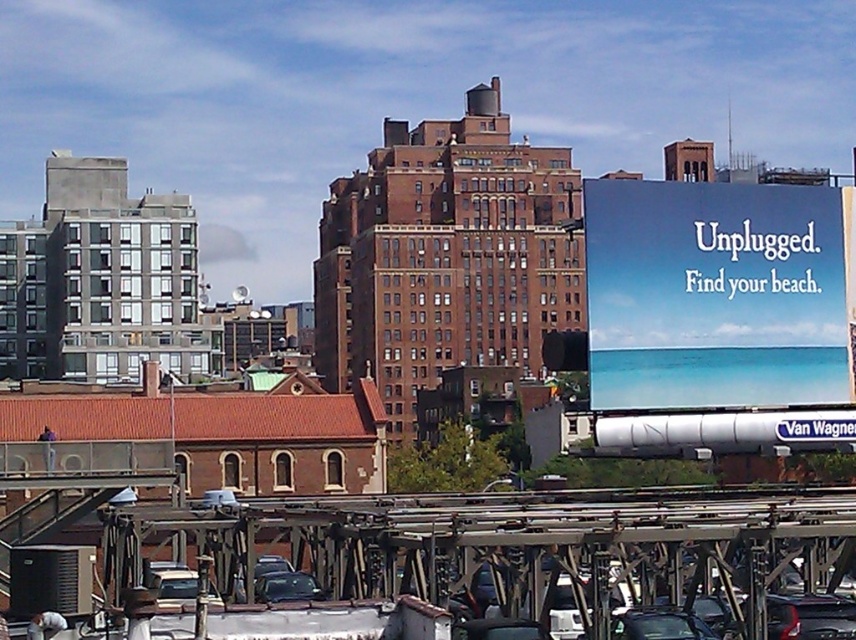
Between point (704, 218) and point (693, 616), which one is positioned in front?

Positioned in front is point (693, 616).

Based on the photo, does blue glossy billboard at upper right appear on the left side of shiny black sedan at center?

No, blue glossy billboard at upper right is not to the left of shiny black sedan at center.

Measure the distance between point [768,257] and camera.

They are 326.50 feet apart.

Where is `blue glossy billboard at upper right`? blue glossy billboard at upper right is located at coordinates (715, 296).

Is the position of metallic gray overpass at lower center less distant than that of shiny black sedan at center?

Yes, it is in front of shiny black sedan at center.

In the scene shown: Which is more to the left, metallic gray overpass at lower center or shiny black sedan at center?

metallic gray overpass at lower center

Does point (591, 621) come farther from viewer compared to point (622, 628)?

No, it is not.

The width and height of the screenshot is (856, 640). What are the coordinates of `metallic gray overpass at lower center` in the screenshot? It's located at (526, 548).

Is metallic gray overpass at lower center taller than shiny black car at center?

Yes.

Which is in front, point (421, 568) or point (289, 577)?

Point (421, 568) is in front.

At what (x,y) coordinates should I click in order to perform the action: click on metallic gray overpass at lower center. Please return your answer as a coordinate pair (x, y). The width and height of the screenshot is (856, 640). Looking at the image, I should click on (526, 548).